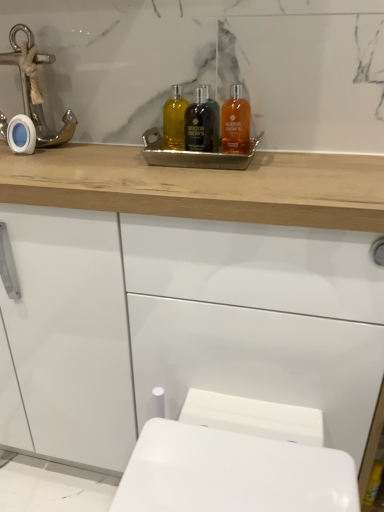
The width and height of the screenshot is (384, 512). Identify the location of free space above white glossy porcelain at lower center (from a real-world perspective). (248, 464).